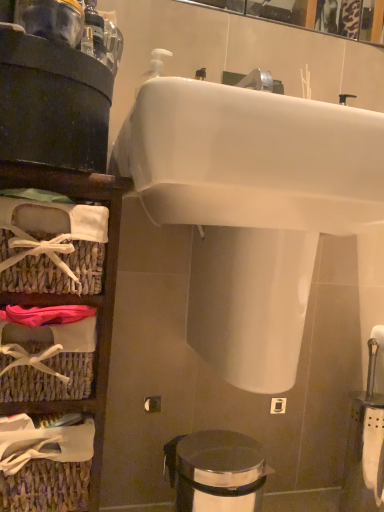
Question: Does white glossy sink at upper center have a lesser height compared to woven wicker basket at left?

Choices:
 (A) no
 (B) yes

Answer: (B)

Question: From the image's perspective, would you say white glossy sink at upper center is shown under woven wicker basket at left?

Choices:
 (A) yes
 (B) no

Answer: (B)

Question: From the image's perspective, is white glossy sink at upper center on woven wicker basket at left?

Choices:
 (A) yes
 (B) no

Answer: (A)

Question: From a real-world perspective, is white glossy sink at upper center located higher than woven wicker basket at left?

Choices:
 (A) no
 (B) yes

Answer: (B)

Question: Does white glossy sink at upper center come behind woven wicker basket at left?

Choices:
 (A) yes
 (B) no

Answer: (B)

Question: Is polished stainless steel trash can at lower center wider or thinner than white glossy sink at upper center?

Choices:
 (A) wide
 (B) thin

Answer: (B)

Question: Is polished stainless steel trash can at lower center situated inside white glossy sink at upper center or outside?

Choices:
 (A) inside
 (B) outside

Answer: (B)

Question: In terms of size, does polished stainless steel trash can at lower center appear bigger or smaller than white glossy sink at upper center?

Choices:
 (A) big
 (B) small

Answer: (B)

Question: Considering their positions, is polished stainless steel trash can at lower center located in front of or behind white glossy sink at upper center?

Choices:
 (A) front
 (B) behind

Answer: (B)

Question: Considering the positions of point (92, 301) and point (248, 451), is point (92, 301) closer or farther from the camera than point (248, 451)?

Choices:
 (A) closer
 (B) farther

Answer: (A)

Question: From a real-world perspective, relative to polished stainless steel trash can at lower center, is woven wicker basket at left vertically above or below?

Choices:
 (A) below
 (B) above

Answer: (B)

Question: Visually, is woven wicker basket at left positioned to the left or to the right of polished stainless steel trash can at lower center?

Choices:
 (A) left
 (B) right

Answer: (A)

Question: Do you think woven wicker basket at left is within polished stainless steel trash can at lower center, or outside of it?

Choices:
 (A) inside
 (B) outside

Answer: (B)

Question: Would you say white glossy sink at upper center is to the left or to the right of polished stainless steel trash can at lower center in the picture?

Choices:
 (A) left
 (B) right

Answer: (B)

Question: From the image's perspective, is white glossy sink at upper center positioned above or below polished stainless steel trash can at lower center?

Choices:
 (A) below
 (B) above

Answer: (B)